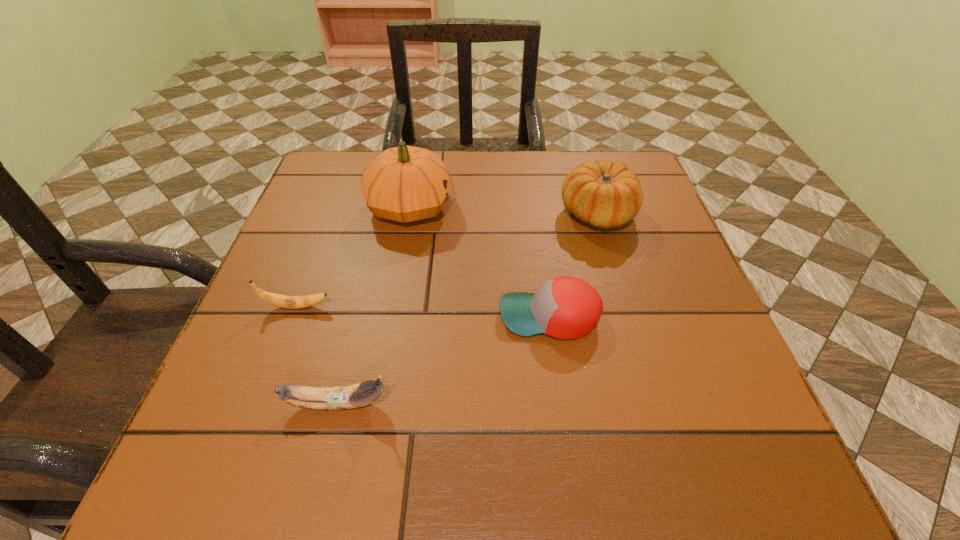
Find the location of a particular element. The width and height of the screenshot is (960, 540). the tallest object is located at coordinates (405, 183).

At what (x,y) coordinates should I click in order to perform the action: click on the taller gourd. Please return your answer as a coordinate pair (x, y). Looking at the image, I should click on (405, 183).

This screenshot has width=960, height=540. I want to click on the right gourd, so click(605, 195).

Identify the location of the shorter gourd. The image size is (960, 540). (605, 195).

Where is `the nearer banana`? the nearer banana is located at coordinates coord(357,395).

Locate an element on the screen. The image size is (960, 540). the taller banana is located at coordinates (357, 395).

The height and width of the screenshot is (540, 960). Identify the location of baseball cap. (565, 307).

Locate an element on the screen. the shorter banana is located at coordinates coord(292,302).

The height and width of the screenshot is (540, 960). Identify the location of vacant space located on the side of the taller gourd with the carved face. (592, 207).

At what (x,y) coordinates should I click in order to perform the action: click on vacant space located on the left of the right gourd. Please return your answer as a coordinate pair (x, y). Looking at the image, I should click on (455, 214).